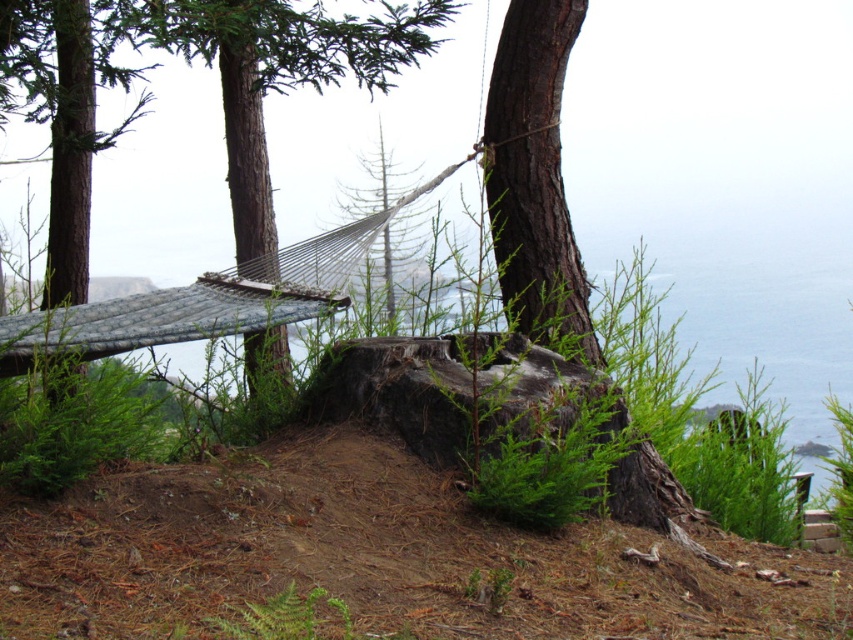
You are standing at the point marked by the coordinates point [282,77] in the image. Looking around, you see a green textured hammock at center. What object are you directly standing on?

You are directly standing on the green textured hammock at center marked by the coordinates point [282,77].

You are standing at the point labeled point (535, 179) in the scene. What is the nearest object to you?

The nearest object to you is the brown rough tree trunk at center, as the point (535, 179) is located on it.